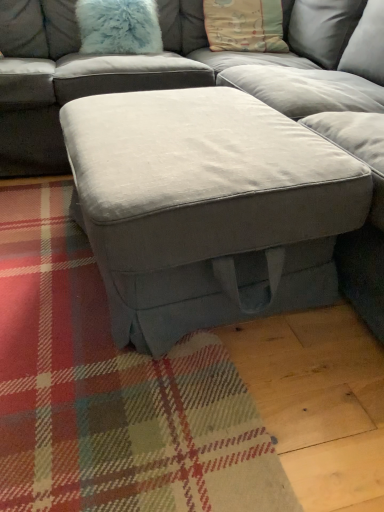
Question: From the image's perspective, is pastel cotton pillow at upper center, arranged as the first pillow when viewed from the right, positioned above or below suede gray ottoman at center?

Choices:
 (A) below
 (B) above

Answer: (B)

Question: Is point (273, 16) closer or farther from the camera than point (268, 164)?

Choices:
 (A) closer
 (B) farther

Answer: (B)

Question: Which object is the farthest from the fuzzy light blue pillow at upper left, the first pillow viewed from the left?

Choices:
 (A) pastel cotton pillow at upper center, the second pillow in the left-to-right sequence
 (B) suede gray ottoman at center

Answer: (B)

Question: Estimate the real-world distances between objects in this image. Which object is farther from the suede gray ottoman at center?

Choices:
 (A) fuzzy light blue pillow at upper left, the first pillow viewed from the left
 (B) pastel cotton pillow at upper center, arranged as the first pillow when viewed from the right

Answer: (A)